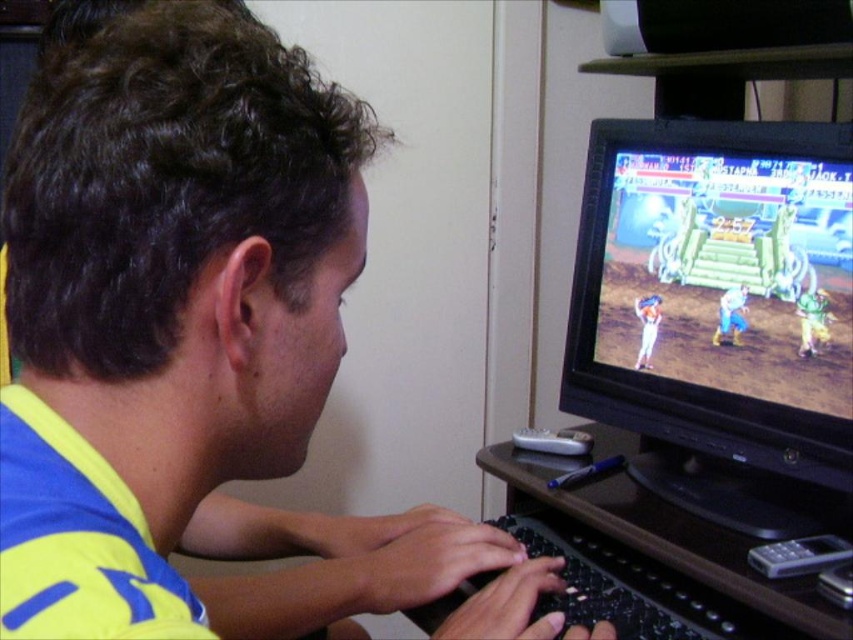
Question: Among these points, which one is nearest to the camera?

Choices:
 (A) (151, 515)
 (B) (798, 232)
 (C) (437, 625)

Answer: (A)

Question: Can you confirm if black glossy monitor at right is positioned above black plastic keyboard at lower center?

Choices:
 (A) no
 (B) yes

Answer: (B)

Question: Which point is farther to the camera?

Choices:
 (A) (335, 250)
 (B) (709, 272)

Answer: (B)

Question: Which point is farther to the camera?

Choices:
 (A) blue/yellow jersey at center
 (B) black glossy monitor at right
 (C) black plastic keyboard at lower center

Answer: (B)

Question: Is blue/yellow jersey at center thinner than black glossy monitor at right?

Choices:
 (A) no
 (B) yes

Answer: (B)

Question: Can you confirm if blue/yellow jersey at center is positioned above black glossy monitor at right?

Choices:
 (A) no
 (B) yes

Answer: (B)